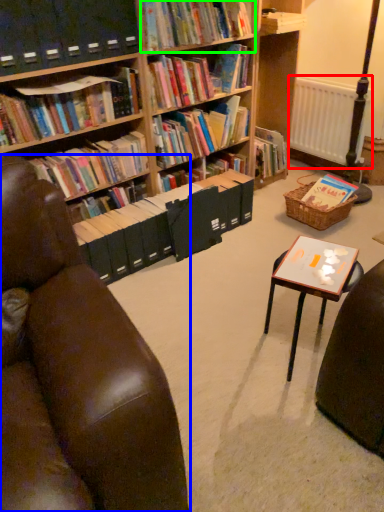
Question: Based on their relative distances, which object is farther from radiator (highlighted by a red box)? Choose from chair (highlighted by a blue box) and book (highlighted by a green box).

Choices:
 (A) chair
 (B) book

Answer: (A)